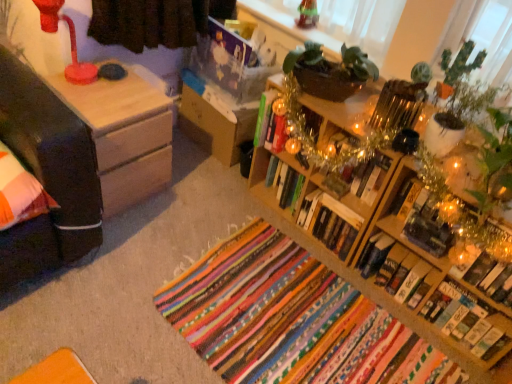
Locate an element on the screen. space that is in front of hardcover book at center, positioned as the 1th book in right-to-left order is located at coordinates (451, 364).